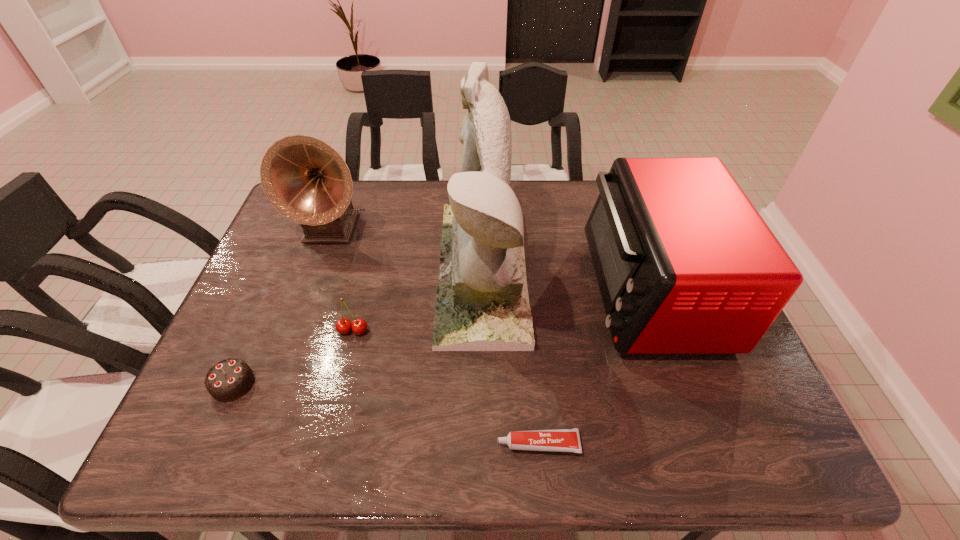
In order to click on free region located on the base of the tallest object in this screenshot , I will do `click(348, 272)`.

At what (x,y) coordinates should I click in order to perform the action: click on vacant space located 0.280m on the base of the tallest object. Please return your answer as a coordinate pair (x, y). This screenshot has width=960, height=540. Looking at the image, I should click on (338, 272).

Image resolution: width=960 pixels, height=540 pixels. Find the location of `vacant space located on the horn of the phonograph record`. vacant space located on the horn of the phonograph record is located at coordinates (280, 368).

Where is `blank space located 0.380m on the front-facing side of the fourth shortest object`? The height and width of the screenshot is (540, 960). blank space located 0.380m on the front-facing side of the fourth shortest object is located at coordinates (444, 290).

This screenshot has width=960, height=540. What are the coordinates of `vacant region located 0.050m on the front-facing side of the fourth shortest object` in the screenshot? It's located at (568, 290).

Locate an element on the screen. The width and height of the screenshot is (960, 540). vacant space located on the front-facing side of the fourth shortest object is located at coordinates (485, 290).

The height and width of the screenshot is (540, 960). Find the location of `vacant space situated with the stems of the cherry pointing upwards`. vacant space situated with the stems of the cherry pointing upwards is located at coordinates (334, 407).

In order to click on vacant area located on the back of the chocolate cake in this screenshot , I will do `click(266, 309)`.

What are the coordinates of `free location located at the nozzle of the nearest object` in the screenshot? It's located at (337, 444).

Find the location of `free space located at the nozzle of the nearest object`. free space located at the nozzle of the nearest object is located at coordinates (437, 444).